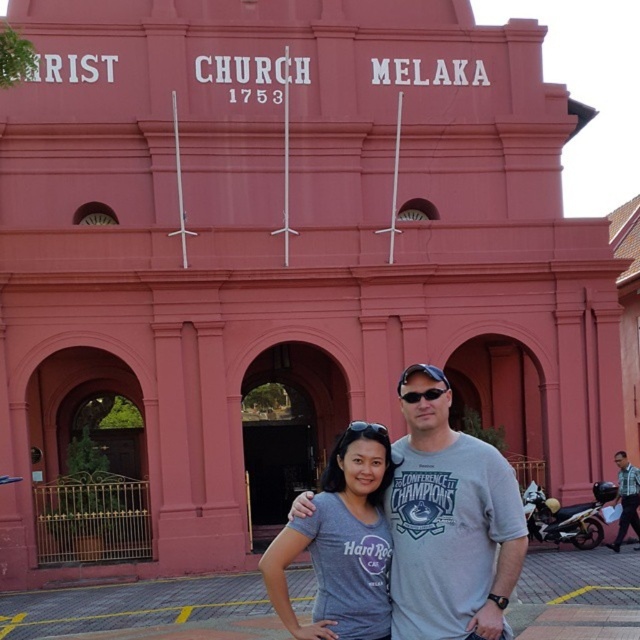
Does gray t-shirt at center have a smaller size compared to matte gray t-shirt at center?

No.

Does gray t-shirt at center have a greater width compared to matte gray t-shirt at center?

Yes, gray t-shirt at center is wider than matte gray t-shirt at center.

The image size is (640, 640). I want to click on gray t-shirt at center, so click(449, 522).

Between point (444, 525) and point (627, 477), which one is positioned in front?

Point (444, 525)

Measure the distance between point (x=520, y=518) and camera.

Point (x=520, y=518) is 24.71 meters from camera.

Does point (440, 461) come closer to viewer compared to point (620, 461)?

That is True.

Where is `gray t-shirt at center`? The image size is (640, 640). gray t-shirt at center is located at coordinates (449, 522).

The image size is (640, 640). I want to click on matte gray t-shirt at center, so click(x=340, y=544).

Between point (378, 486) and point (627, 502), which one is positioned behind?

The point (627, 502) is behind.

Locate an element on the screen. matte gray t-shirt at center is located at coordinates (340, 544).